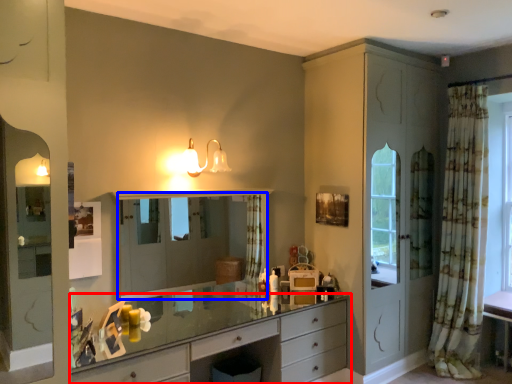
Question: Among these objects, which one is nearest to the camera, chest of drawers (highlighted by a red box) or mirror (highlighted by a blue box)?

Choices:
 (A) chest of drawers
 (B) mirror

Answer: (A)